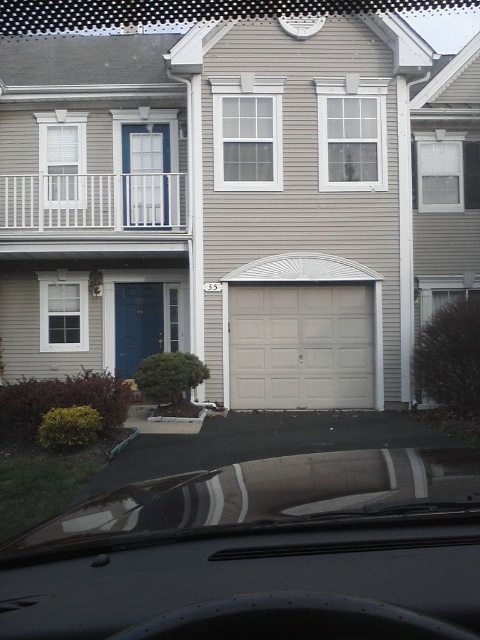
Is black matte dashboard at lower center shorter than transparent glass windshield at center?

Indeed, black matte dashboard at lower center has a lesser height compared to transparent glass windshield at center.

Who is shorter, black matte dashboard at lower center or transparent glass windshield at center?

black matte dashboard at lower center is shorter.

Locate an element on the screen. Image resolution: width=480 pixels, height=640 pixels. black matte dashboard at lower center is located at coordinates (255, 582).

Is transparent glass windshield at center shorter than white smooth garage door at center?

Yes.

Which is behind, point (183, 513) or point (264, 305)?

Point (264, 305)

Between point (264, 461) and point (300, 304), which one is positioned behind?

Point (300, 304)

This screenshot has height=640, width=480. Find the location of `transparent glass windshield at center`. transparent glass windshield at center is located at coordinates (268, 496).

Based on the photo, who is more distant from viewer, (468,598) or (231,298)?

The point (231,298) is behind.

Which of these two, black matte dashboard at lower center or white smooth garage door at center, stands shorter?

black matte dashboard at lower center

Identify the location of black matte dashboard at lower center. Image resolution: width=480 pixels, height=640 pixels. (255, 582).